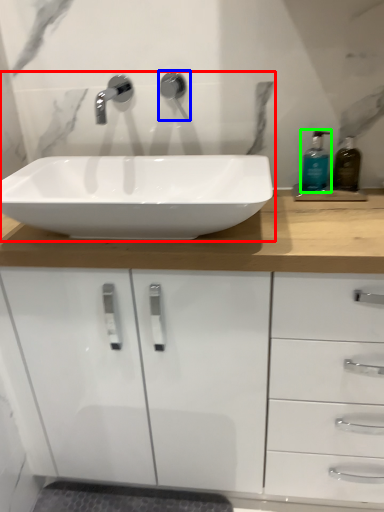
Question: Which is farther away from sink (highlighted by a red box)? plumbing fixture (highlighted by a blue box) or soap dispenser (highlighted by a green box)?

Choices:
 (A) plumbing fixture
 (B) soap dispenser

Answer: (B)